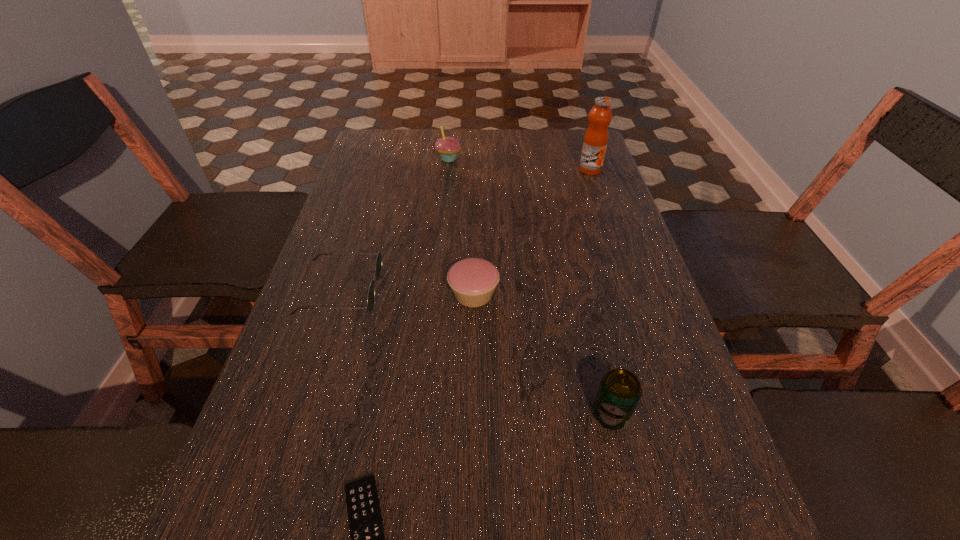
Image resolution: width=960 pixels, height=540 pixels. In order to click on fruit juice in this screenshot , I will do `click(595, 142)`.

Locate an element on the screen. The image size is (960, 540). the tallest object is located at coordinates 595,142.

Locate an element on the screen. the farther cupcake is located at coordinates (448, 147).

In order to click on the taller cupcake in this screenshot , I will do `click(448, 147)`.

Where is `the fourth shortest object`? This screenshot has height=540, width=960. the fourth shortest object is located at coordinates (619, 392).

At what (x,y) coordinates should I click in order to perform the action: click on the fifth farthest object. Please return your answer as a coordinate pair (x, y). The width and height of the screenshot is (960, 540). Looking at the image, I should click on (619, 392).

Identify the location of the fourth tallest object. This screenshot has height=540, width=960. (473, 280).

Where is `the shorter cupcake`? the shorter cupcake is located at coordinates (473, 280).

Identify the location of sunglasses. The width and height of the screenshot is (960, 540). (378, 265).

Locate an element on the screen. the leftmost object is located at coordinates (378, 265).